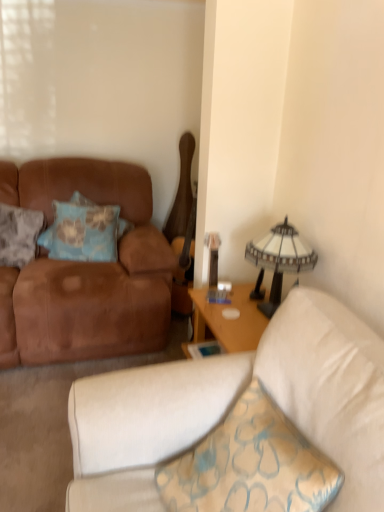
Question: Is blue fabric pillow at left, arranged as the 2th pillow when viewed from the left, at the left side of textured blue pillow at left, positioned as the first pillow in left-to-right order?

Choices:
 (A) no
 (B) yes

Answer: (A)

Question: Considering the relative sizes of blue fabric pillow at left, arranged as the 1th pillow when viewed from the right, and textured blue pillow at left, the 2th pillow when ordered from right to left, in the image provided, is blue fabric pillow at left, arranged as the 1th pillow when viewed from the right, wider than textured blue pillow at left, the 2th pillow when ordered from right to left,?

Choices:
 (A) yes
 (B) no

Answer: (B)

Question: Considering the relative sizes of blue fabric pillow at left, arranged as the 2th pillow when viewed from the left, and textured blue pillow at left, positioned as the first pillow in left-to-right order, in the image provided, is blue fabric pillow at left, arranged as the 2th pillow when viewed from the left, bigger than textured blue pillow at left, positioned as the first pillow in left-to-right order,?

Choices:
 (A) no
 (B) yes

Answer: (B)

Question: Is blue fabric pillow at left, arranged as the 1th pillow when viewed from the right, oriented away from textured blue pillow at left, positioned as the first pillow in left-to-right order?

Choices:
 (A) yes
 (B) no

Answer: (B)

Question: Considering the relative sizes of blue fabric pillow at left, arranged as the 1th pillow when viewed from the right, and textured blue pillow at left, the 2th pillow when ordered from right to left, in the image provided, is blue fabric pillow at left, arranged as the 1th pillow when viewed from the right, shorter than textured blue pillow at left, the 2th pillow when ordered from right to left,?

Choices:
 (A) yes
 (B) no

Answer: (A)

Question: From a real-world perspective, relative to suede brown couch at left, the second studio couch positioned from the back, is white glass lampshade at upper right vertically above or below?

Choices:
 (A) above
 (B) below

Answer: (A)

Question: Based on their sizes in the image, would you say white glass lampshade at upper right is bigger or smaller than suede brown couch at left, the second studio couch positioned from the back?

Choices:
 (A) big
 (B) small

Answer: (B)

Question: In the image, is white glass lampshade at upper right positioned in front of or behind suede brown couch at left, the 1th studio couch viewed from the front?

Choices:
 (A) behind
 (B) front

Answer: (A)

Question: Considering the positions of point (286, 242) and point (324, 293), is point (286, 242) closer or farther from the camera than point (324, 293)?

Choices:
 (A) farther
 (B) closer

Answer: (A)

Question: Is point (97, 423) closer or farther from the camera than point (34, 210)?

Choices:
 (A) closer
 (B) farther

Answer: (A)

Question: Considering the relative positions of suede brown couch at left, the second studio couch positioned from the back, and textured blue pillow at left, positioned as the first pillow in left-to-right order, in the image provided, is suede brown couch at left, the second studio couch positioned from the back, to the left or to the right of textured blue pillow at left, positioned as the first pillow in left-to-right order,?

Choices:
 (A) right
 (B) left

Answer: (A)

Question: In the image, is suede brown couch at left, the 1th studio couch viewed from the front, positioned in front of or behind textured blue pillow at left, the 2th pillow when ordered from right to left?

Choices:
 (A) front
 (B) behind

Answer: (A)

Question: Would you say suede brown couch at left, the 1th studio couch viewed from the front, is inside or outside textured blue pillow at left, positioned as the first pillow in left-to-right order?

Choices:
 (A) outside
 (B) inside

Answer: (A)

Question: Would you say white glass lampshade at upper right is to the left or to the right of textured blue pillow at left, positioned as the first pillow in left-to-right order, in the picture?

Choices:
 (A) left
 (B) right

Answer: (B)

Question: Is white glass lampshade at upper right inside or outside of textured blue pillow at left, the 2th pillow when ordered from right to left?

Choices:
 (A) inside
 (B) outside

Answer: (B)